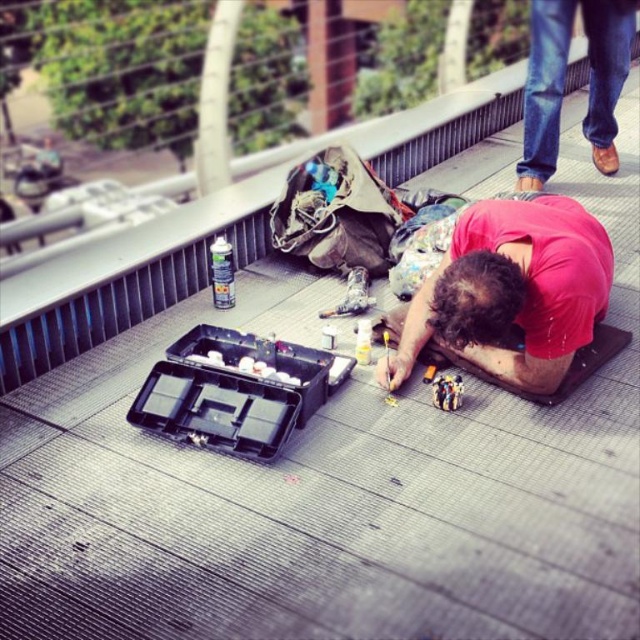
Question: Which point is farther to the camera?

Choices:
 (A) (609, 44)
 (B) (452, 342)

Answer: (A)

Question: Does red matte shirt at center appear over brown leather shoes at upper right?

Choices:
 (A) yes
 (B) no

Answer: (B)

Question: Is red matte shirt at center thinner than brown leather shoes at upper right?

Choices:
 (A) yes
 (B) no

Answer: (B)

Question: Can you confirm if red matte shirt at center is positioned below brown leather shoes at upper right?

Choices:
 (A) no
 (B) yes

Answer: (B)